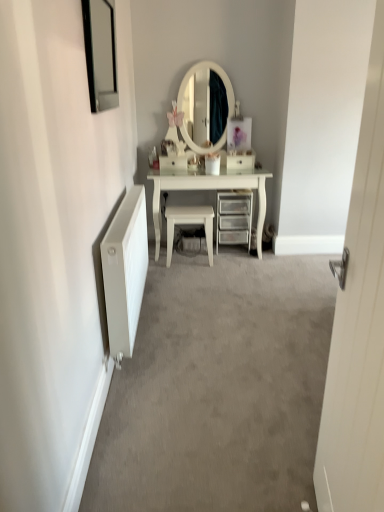
This screenshot has width=384, height=512. I want to click on free space in front of white glossy stool at center, so click(197, 273).